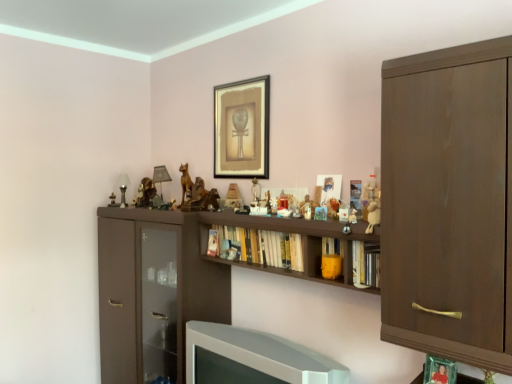
Question: In which direction should I rotate to look at hardcover books at center, the third book from the front?

Choices:
 (A) right
 (B) left

Answer: (A)

Question: Is white glossy television at lower center outside of yellow matte bookshelf at center, which is the second book in right-to-left order?

Choices:
 (A) yes
 (B) no

Answer: (A)

Question: Is white glossy television at lower center at the right side of yellow matte bookshelf at center, acting as the second book starting from the front?

Choices:
 (A) no
 (B) yes

Answer: (A)

Question: Is white glossy television at lower center with yellow matte bookshelf at center, marked as the 2th book in a back-to-front arrangement?

Choices:
 (A) no
 (B) yes

Answer: (A)

Question: Does white glossy television at lower center have a larger size compared to yellow matte bookshelf at center, which is the second book in right-to-left order?

Choices:
 (A) yes
 (B) no

Answer: (A)

Question: Could you tell me if white glossy television at lower center is facing yellow matte bookshelf at center, which is counted as the 2th book, starting from the left?

Choices:
 (A) no
 (B) yes

Answer: (A)

Question: Is white glossy television at lower center far away from yellow matte bookshelf at center, marked as the 2th book in a back-to-front arrangement?

Choices:
 (A) no
 (B) yes

Answer: (A)

Question: Is matte black picture frame at upper center smaller than matte wooden figurine at center, marked as the 2th toy in a back-to-front arrangement?

Choices:
 (A) yes
 (B) no

Answer: (B)

Question: From the image's perspective, is matte black picture frame at upper center located above matte wooden figurine at center, the third toy when ordered from front to back?

Choices:
 (A) no
 (B) yes

Answer: (B)

Question: Does matte black picture frame at upper center have a greater height compared to matte wooden figurine at center, which ranks as the third toy in right-to-left order?

Choices:
 (A) yes
 (B) no

Answer: (A)

Question: Is matte wooden figurine at center, the third toy when ordered from front to back, at the back of matte black picture frame at upper center?

Choices:
 (A) no
 (B) yes

Answer: (A)

Question: Is matte black picture frame at upper center bigger than matte wooden figurine at center, which ranks as the third toy in right-to-left order?

Choices:
 (A) yes
 (B) no

Answer: (A)

Question: Is matte black picture frame at upper center positioned beyond the bounds of matte wooden figurine at center, the third toy when ordered from front to back?

Choices:
 (A) yes
 (B) no

Answer: (A)

Question: Is hardcover books at center, marked as the first book in a left-to-right arrangement, to the left of dark brown wood cabinet at right from the viewer's perspective?

Choices:
 (A) no
 (B) yes

Answer: (B)